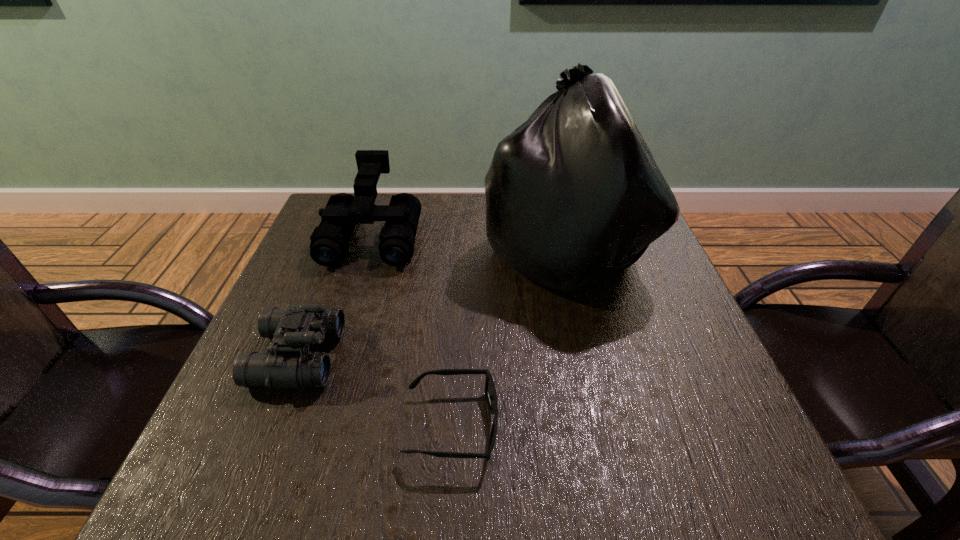
At what (x,y) coordinates should I click in order to perform the action: click on the tallest object. Please return your answer as a coordinate pair (x, y). The width and height of the screenshot is (960, 540). Looking at the image, I should click on (573, 194).

I want to click on the taller binoculars, so click(x=329, y=243).

The width and height of the screenshot is (960, 540). Find the location of `the second tallest object`. the second tallest object is located at coordinates (329, 243).

The height and width of the screenshot is (540, 960). I want to click on the second shortest object, so click(290, 365).

This screenshot has width=960, height=540. Identify the location of the shorter binoculars. (290, 365).

At what (x,y) coordinates should I click in order to perform the action: click on sunglasses. Please return your answer as a coordinate pair (x, y). Looking at the image, I should click on (490, 391).

At what (x,y) coordinates should I click in order to perform the action: click on free region located 0.130m on the left of the tallest object. Please return your answer as a coordinate pair (x, y). Looking at the image, I should click on (432, 249).

What are the coordinates of `vacant space located 0.090m on the front lenses of the second tallest object` in the screenshot? It's located at (354, 295).

Where is `free space located 0.320m through the lenses of the nearer binoculars`? The width and height of the screenshot is (960, 540). free space located 0.320m through the lenses of the nearer binoculars is located at coordinates (502, 356).

Identify the location of free region located on the front-facing side of the sunglasses. (694, 426).